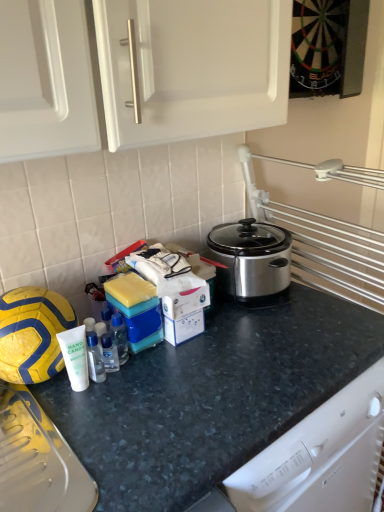
Find the location of a particular element. free location above dark gray granite countertop at center (from a real-world perspective) is located at coordinates (258, 342).